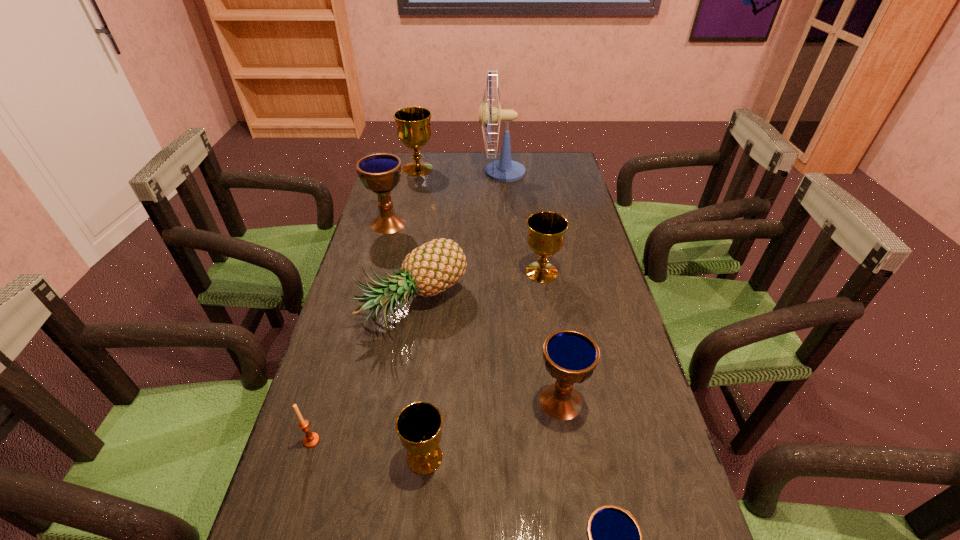
Point out which object is positioned as the sixth nearest to the pineapple. Please provide its 2D coordinates. Your answer should be formatted as a tuple, i.e. [(x, y)], where the tuple contains the x and y coordinates of a point satisfying the conditions above.

[(504, 170)]

At what (x,y) coordinates should I click in order to perform the action: click on chalice object that ranks as the closest to the fan. Please return your answer as a coordinate pair (x, y). The height and width of the screenshot is (540, 960). Looking at the image, I should click on (413, 123).

The width and height of the screenshot is (960, 540). Find the location of `the fourth closest chalice to the second gold chalice from left to right`. the fourth closest chalice to the second gold chalice from left to right is located at coordinates (381, 172).

The height and width of the screenshot is (540, 960). Find the location of `the second closest gold chalice to the pineapple`. the second closest gold chalice to the pineapple is located at coordinates (419, 424).

The height and width of the screenshot is (540, 960). Identify the location of the closest gold chalice to the farthest blue chalice. (413, 123).

Identify the location of blue chalice that is the closest to the pineapple. The image size is (960, 540). (381, 172).

Locate which blue chalice ranks in proximity to the candle_holder. Please provide its 2D coordinates. Your answer should be formatted as a tuple, i.e. [(x, y)], where the tuple contains the x and y coordinates of a point satisfying the conditions above.

[(570, 356)]

Where is `vacant position in the image that satisfies the following two spatial constraints: 1. on the back side of the second nearest gold chalice; 2. on the left side of the third nearest chalice`? This screenshot has width=960, height=540. vacant position in the image that satisfies the following two spatial constraints: 1. on the back side of the second nearest gold chalice; 2. on the left side of the third nearest chalice is located at coordinates (540, 272).

Locate an element on the screen. Image resolution: width=960 pixels, height=540 pixels. free space that satisfies the following two spatial constraints: 1. at the front of the third nearest chalice where the blades are visible; 2. on the left side of the fan is located at coordinates (519, 401).

At what (x,y) coordinates should I click in order to perform the action: click on blank area in the image that satisfies the following two spatial constraints: 1. at the front of the blue fan where the blades are visible; 2. on the right side of the second smallest gold chalice. Please return your answer as a coordinate pair (x, y). The width and height of the screenshot is (960, 540). Looking at the image, I should click on (510, 272).